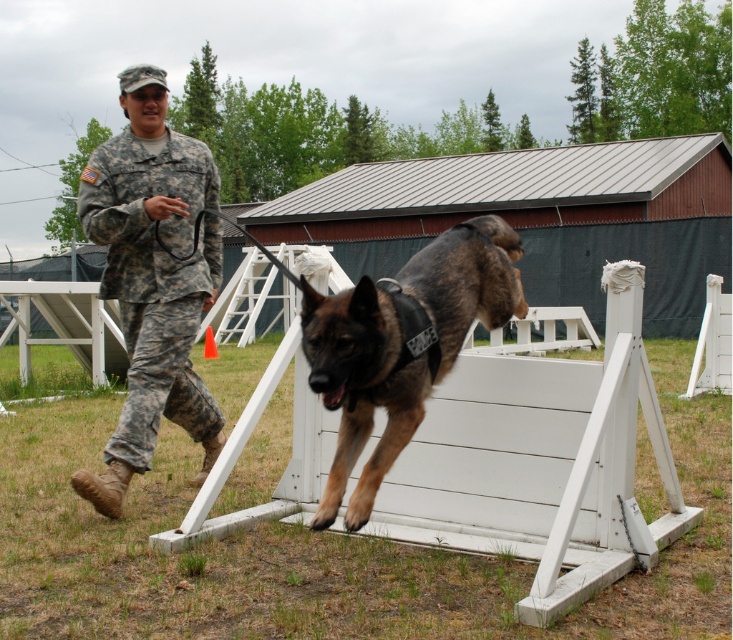
Question: Can you confirm if white wood hurdle at center is positioned below brindle fur dog at center?

Choices:
 (A) no
 (B) yes

Answer: (B)

Question: Does white wood hurdle at center have a smaller size compared to brindle fur dog at center?

Choices:
 (A) yes
 (B) no

Answer: (B)

Question: Does white wood hurdle at center appear over camouflage uniform at left?

Choices:
 (A) yes
 (B) no

Answer: (B)

Question: Which point is closer to the camera?

Choices:
 (A) camouflage uniform at left
 (B) brindle fur dog at center
 (C) white wood hurdle at center

Answer: (B)

Question: Considering the real-world distances, which object is closest to the white wood hurdle at center?

Choices:
 (A) brindle fur dog at center
 (B) camouflage uniform at left

Answer: (A)

Question: Which object is the closest to the brindle fur dog at center?

Choices:
 (A) white wood hurdle at center
 (B) camouflage uniform at left

Answer: (A)